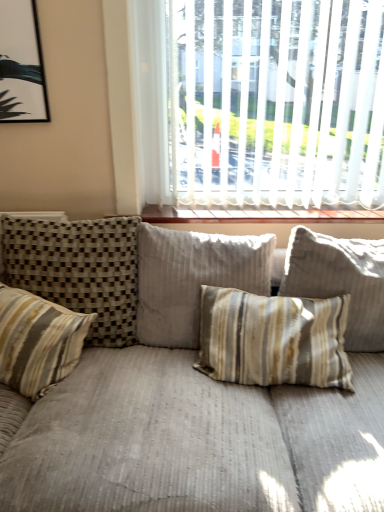
Question: Looking at their shapes, would you say striped fabric pillow at center, the 1th pillow from the right, is wider or thinner than white blinds at upper center?

Choices:
 (A) thin
 (B) wide

Answer: (B)

Question: In terms of height, does striped fabric pillow at center, positioned as the 4th pillow in left-to-right order, look taller or shorter compared to white blinds at upper center?

Choices:
 (A) tall
 (B) short

Answer: (B)

Question: Which of these objects is positioned closest to the striped fabric pillow at left, which appears as the second pillow when viewed from the left?

Choices:
 (A) striped fabric pillow at center, the third pillow positioned from the left
 (B) wooden at upper center
 (C) striped fabric pillow at left, which appears as the fourth pillow when viewed from the right
 (D) striped fabric pillow at center, positioned as the 4th pillow in left-to-right order
 (E) white blinds at upper center

Answer: (C)

Question: Estimate the real-world distances between objects in this image. Which object is farther from the striped fabric pillow at center, positioned as the 4th pillow in left-to-right order?

Choices:
 (A) striped fabric pillow at left, which appears as the second pillow when viewed from the left
 (B) white blinds at upper center
 (C) striped fabric pillow at center, the third pillow positioned from the left
 (D) striped fabric pillow at left, arranged as the 1th pillow when viewed from the left
 (E) wooden at upper center

Answer: (D)